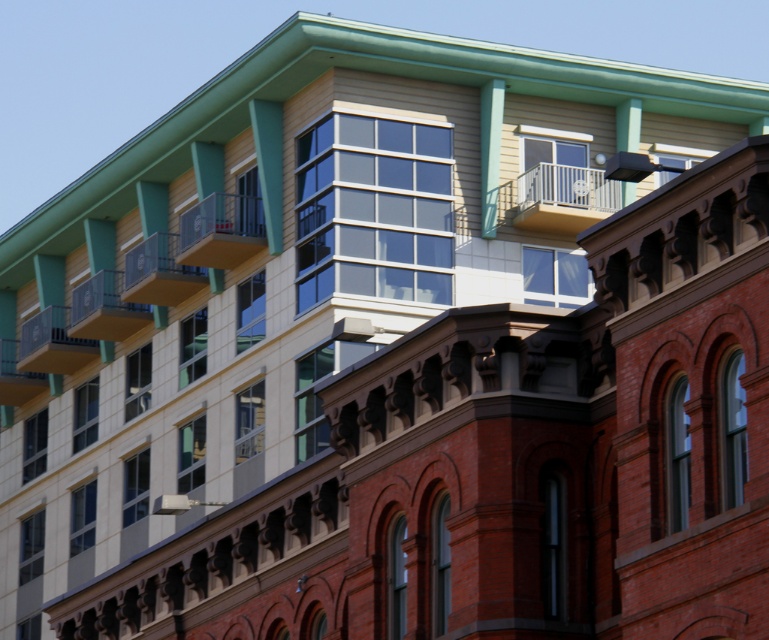
What are the coordinates of `wooden balcony at upper center` in the screenshot? It's located at (221, 230).

Between wooden balcony at upper center and matte black balcony at upper left, which one is positioned higher?

wooden balcony at upper center

Who is more forward, (232, 208) or (75, 298)?

Point (232, 208) is in front.

Image resolution: width=769 pixels, height=640 pixels. Find the location of `wooden balcony at upper center`. wooden balcony at upper center is located at coordinates (221, 230).

Is point (258, 211) closer to viewer compared to point (201, 275)?

Yes.

Who is lower down, wooden balcony at upper center or matte yellow balcony at upper center?

matte yellow balcony at upper center

Does point (252, 212) come closer to viewer compared to point (140, 273)?

Yes, point (252, 212) is in front of point (140, 273).

The height and width of the screenshot is (640, 769). Find the location of `wooden balcony at upper center`. wooden balcony at upper center is located at coordinates tap(221, 230).

Between point (543, 227) and point (198, 276), which one is positioned in front?

Positioned in front is point (543, 227).

Does white metal balcony at upper center have a lesser width compared to matte yellow balcony at upper center?

No, white metal balcony at upper center is not thinner than matte yellow balcony at upper center.

Who is more forward, (511, 212) or (125, 264)?

Point (511, 212) is in front.

At what (x,y) coordinates should I click in order to perform the action: click on white metal balcony at upper center. Please return your answer as a coordinate pair (x, y). Looking at the image, I should click on (558, 198).